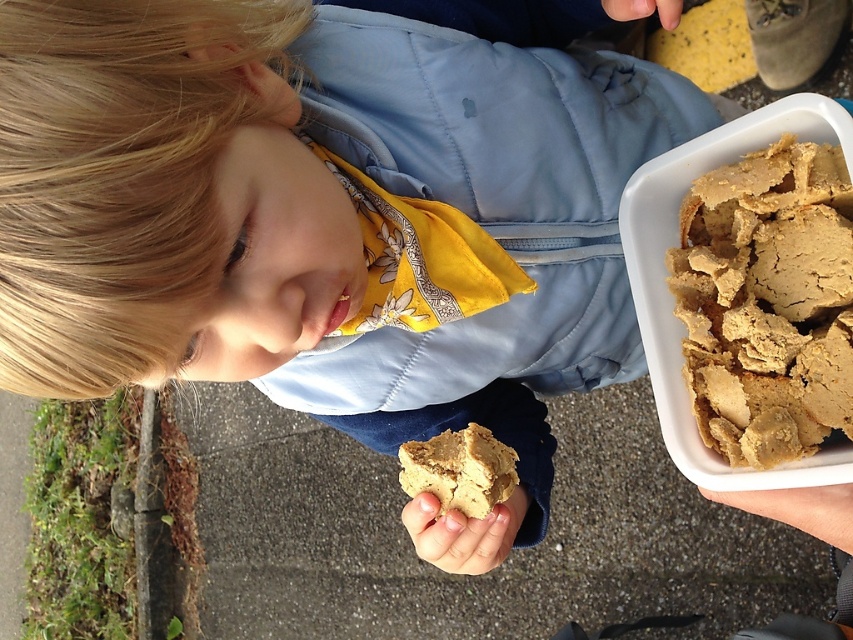
Is golden crumbly cookie at lower center wider than smooth beige cookie at lower center?

No, golden crumbly cookie at lower center is not wider than smooth beige cookie at lower center.

Is point (416, 445) closer to viewer compared to point (436, 563)?

Yes, point (416, 445) is closer to viewer.

Find the location of `golden crumbly cookie at lower center`. golden crumbly cookie at lower center is located at coordinates (459, 468).

Does smooth beige cookie at lower center have a lesser height compared to smooth skin hand at lower right?

No, smooth beige cookie at lower center is not shorter than smooth skin hand at lower right.

Where is `smooth beige cookie at lower center`? smooth beige cookie at lower center is located at coordinates (463, 532).

Which is below, brown crumbly cookie at upper right or smooth beige cookie at lower center?

smooth beige cookie at lower center is below.

Which of these two, brown crumbly cookie at upper right or smooth beige cookie at lower center, stands taller?

brown crumbly cookie at upper right

Identify the location of brown crumbly cookie at upper right. Image resolution: width=853 pixels, height=640 pixels. (767, 301).